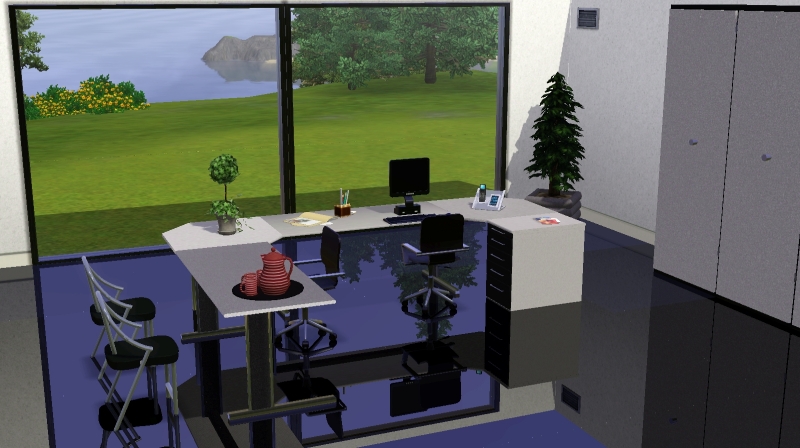
Locate an element on the screen. The height and width of the screenshot is (448, 800). monitor is located at coordinates (406, 175).